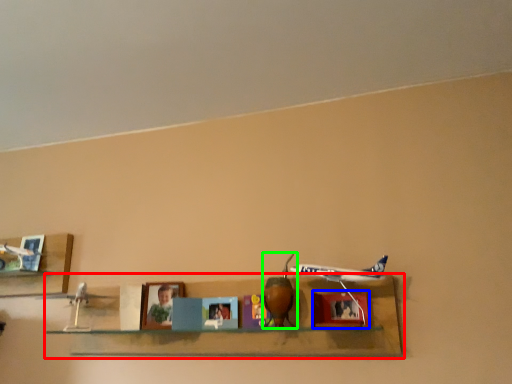
Question: Which is nearer to the shelf (highlighted by a red box)? picture frame (highlighted by a blue box) or toy (highlighted by a green box).

Choices:
 (A) picture frame
 (B) toy

Answer: (A)